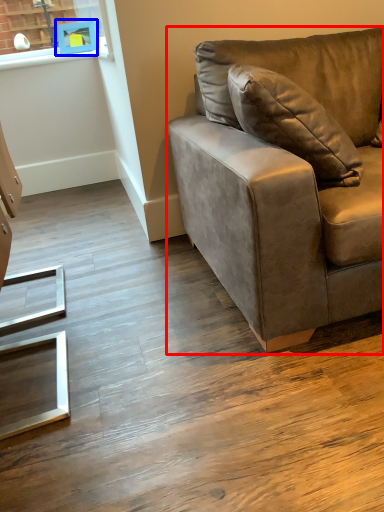
Question: Which object is closer to the camera taking this photo, studio couch (highlighted by a red box) or picture frame (highlighted by a blue box)?

Choices:
 (A) studio couch
 (B) picture frame

Answer: (A)